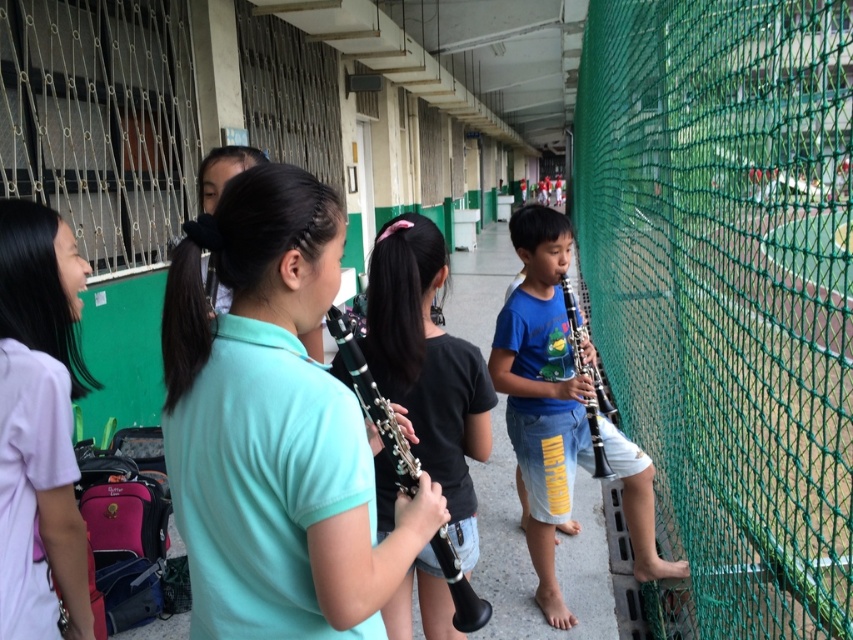
Question: Which is farther from the blue matte clarinet at center?

Choices:
 (A) light purple cotton shirt at left
 (B) blue matte hautboy at right

Answer: (A)

Question: Considering the relative positions of light purple cotton shirt at left and black plastic clarinet at center in the image provided, where is light purple cotton shirt at left located with respect to black plastic clarinet at center?

Choices:
 (A) above
 (B) below

Answer: (A)

Question: Which point is closer to the camera?

Choices:
 (A) (51, 230)
 (B) (680, 524)
 (C) (610, 474)
 (D) (227, 472)

Answer: (D)

Question: Among these objects, which one is nearest to the camera?

Choices:
 (A) blue matte hautboy at right
 (B) blue matte clarinet at center
 (C) green mesh fence at right
 (D) black plastic clarinet at center

Answer: (C)

Question: Is light purple cotton shirt at left closer to the viewer compared to blue matte clarinet at center?

Choices:
 (A) no
 (B) yes

Answer: (B)

Question: Does blue matte hautboy at right have a larger size compared to light purple cotton shirt at left?

Choices:
 (A) no
 (B) yes

Answer: (B)